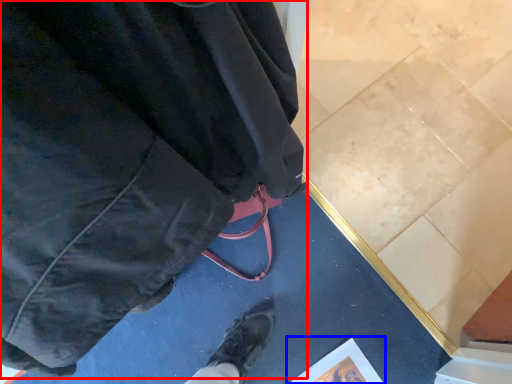
Question: Which point is further to the camera, jacket (highlighted by a red box) or paperback book (highlighted by a blue box)?

Choices:
 (A) jacket
 (B) paperback book

Answer: (B)